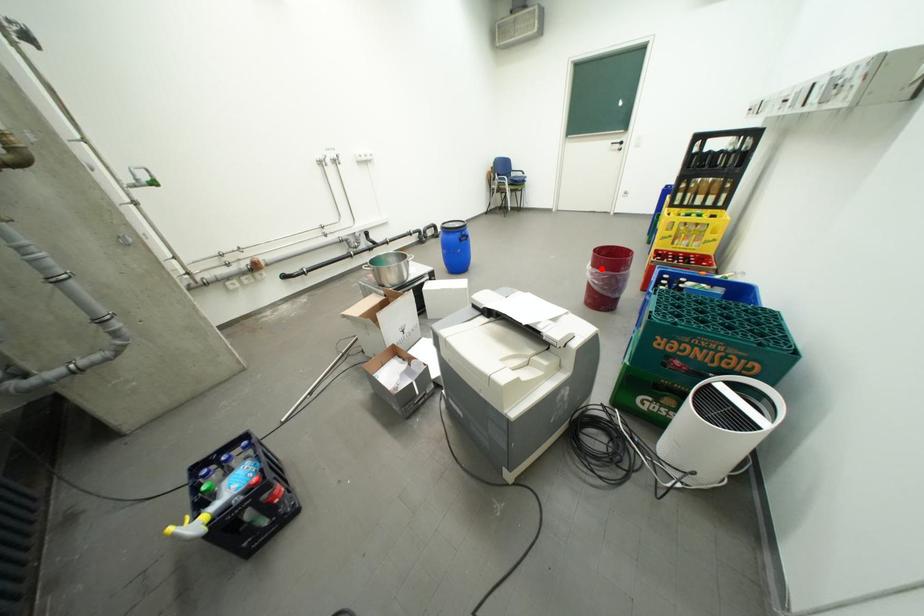
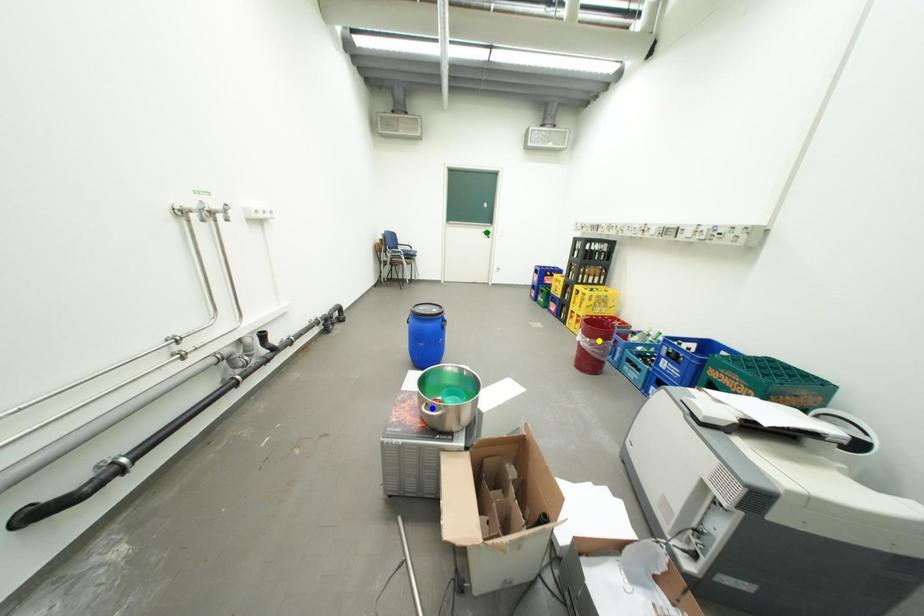
Question: I am providing you with two images of the same scene from different viewpoints. A red point is marked on the first image. You are given multiple points on the second image. Can you choose the point in image 2 that corresponds to the point in image 1?

Choices:
 (A) green point
 (B) yellow point
 (C) blue point

Answer: (B)